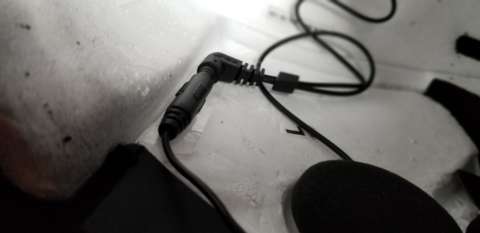
This screenshot has height=233, width=480. I want to click on leftmost wall, so click(65, 71).